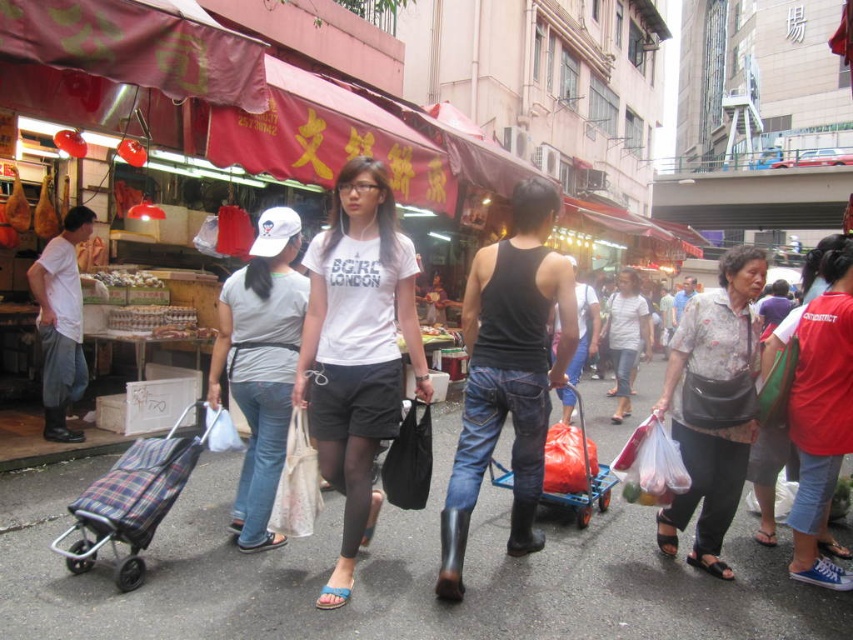
Identify the location of printed fabric blouse at center. (712, 406).

Who is more forward, (x=746, y=433) or (x=236, y=353)?

Positioned in front is point (x=236, y=353).

Locate an element on the screen. This screenshot has height=640, width=853. printed fabric blouse at center is located at coordinates (712, 406).

Can you confirm if gray fabric shirt at center is shorter than blue plastic cart at center?

No, gray fabric shirt at center is not shorter than blue plastic cart at center.

Between gray fabric shirt at center and blue plastic cart at center, which one is positioned lower?

blue plastic cart at center

Is point (236, 349) closer to viewer compared to point (608, 472)?

Yes, it is in front of point (608, 472).

Find the location of a particular element. gray fabric shirt at center is located at coordinates (260, 364).

Is point (228, 314) closer to camera compared to point (807, 353)?

No.

Can you confirm if gray fabric shirt at center is positioned below red cotton shirt at right?

Incorrect, gray fabric shirt at center is not positioned below red cotton shirt at right.

Image resolution: width=853 pixels, height=640 pixels. What are the coordinates of `gray fabric shirt at center` in the screenshot? It's located at (260, 364).

Find the location of a particular element. This screenshot has height=640, width=853. gray fabric shirt at center is located at coordinates (260, 364).